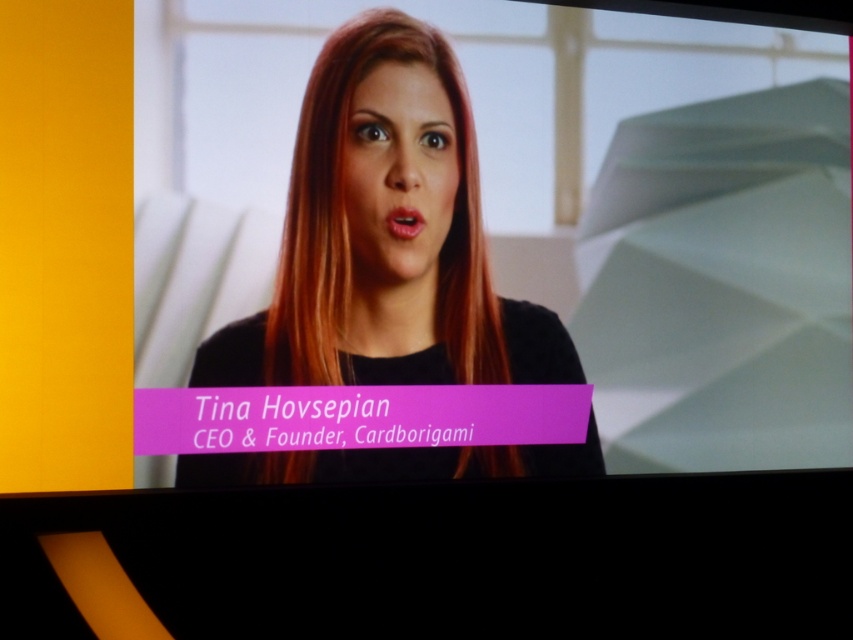
Does black matte hair at center appear under smooth skin face at center?

Correct, black matte hair at center is located below smooth skin face at center.

Is point (454, 380) farther from camera compared to point (425, 198)?

Yes, point (454, 380) is farther from viewer.

You are a GUI agent. You are given a task and a screenshot of the screen. Output one action in this format:
    pyautogui.click(x=<x>, y=<y>)
    Task: Click on the black matte hair at center
    The width and height of the screenshot is (853, 640).
    Given the screenshot: What is the action you would take?
    pyautogui.click(x=386, y=236)